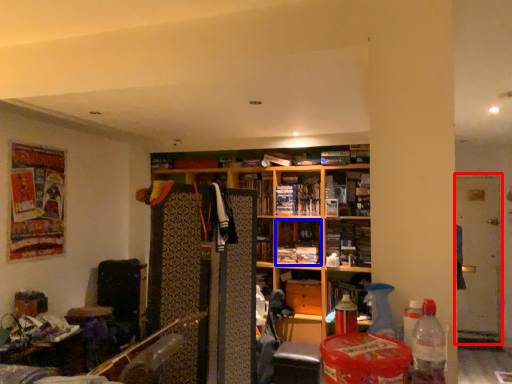
Question: Which object is further to the camera taking this photo, glass door (highlighted by a red box) or book (highlighted by a blue box)?

Choices:
 (A) glass door
 (B) book

Answer: (A)